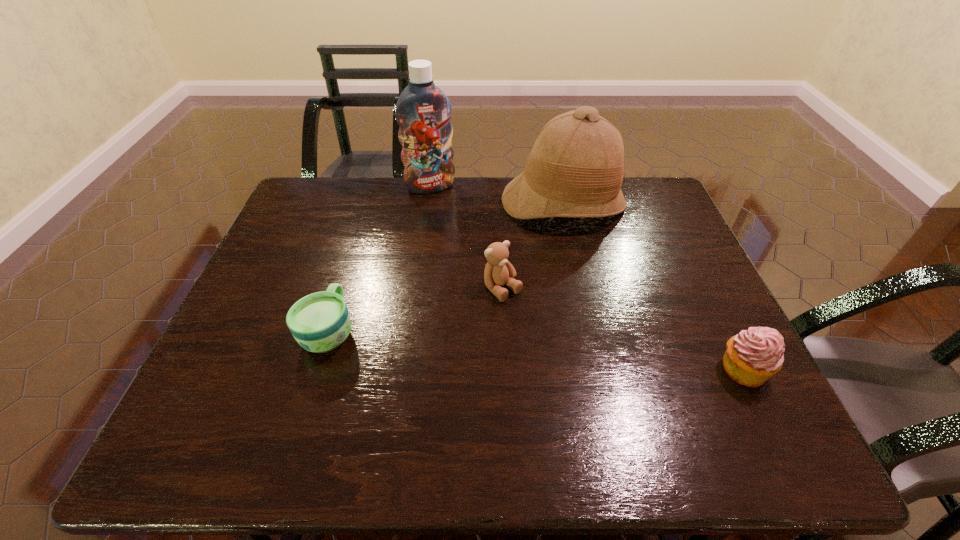
Locate an element on the screen. The height and width of the screenshot is (540, 960). free point between the shortest object and the hat is located at coordinates (446, 267).

Find the location of a particular element. The image size is (960, 540). object that can be found as the closest to the fourth shortest object is located at coordinates (423, 111).

Where is `object that stands as the closest to the tallest object`? Image resolution: width=960 pixels, height=540 pixels. object that stands as the closest to the tallest object is located at coordinates (575, 169).